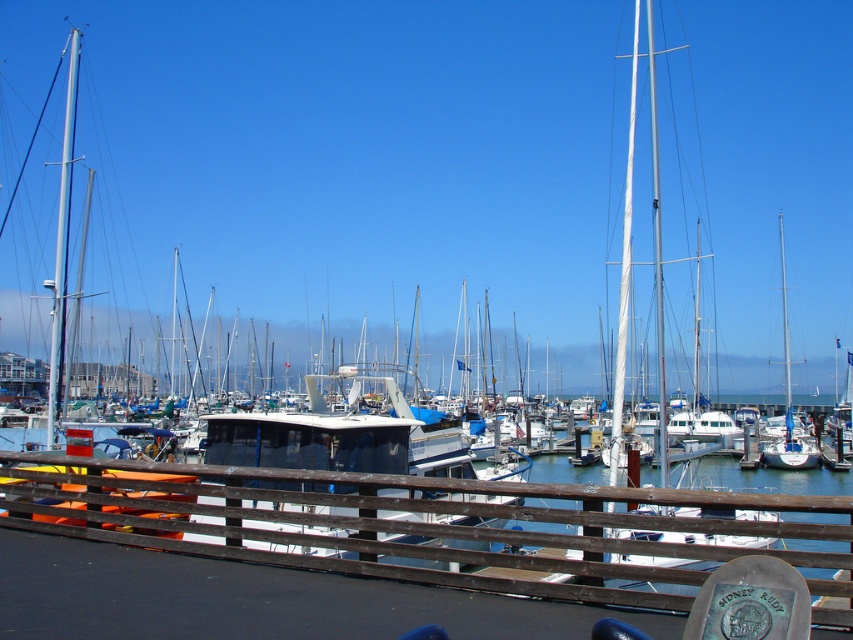
Based on the photo, you are standing at the wooden railing and want to board the white matte sailboat at center. Which direction should you walk along the railing to reach it from the silver metallic mast at left?

The white matte sailboat at center is positioned over the silver metallic mast at left, meaning it is closer to the viewer. To reach the white matte sailboat at center from the silver metallic mast at left, you should walk towards the center along the railing since it is positioned over the mast, indicating it is in front of it.

Based on the photo, you are a photographer standing at the wooden railing. You want to take a photo of the white matte sailboat at center and the silver metallic mast at left. Which object will appear closer to the camera in the photo?

The white matte sailboat at center will appear closer to the camera in the photo because it is in front of the silver metallic mast at left.